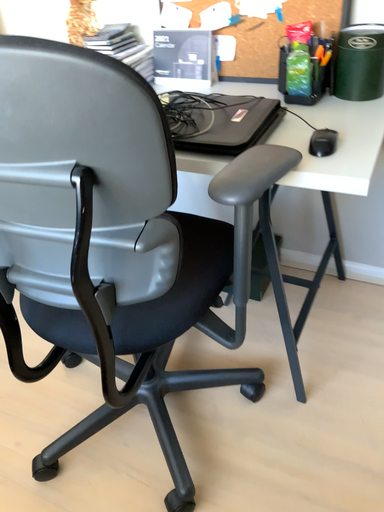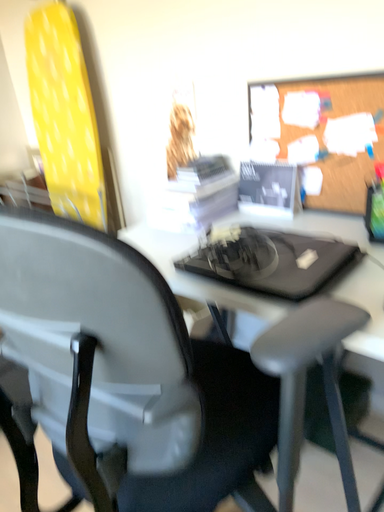
Question: Which way did the camera rotate in the video?

Choices:
 (A) rotated left
 (B) rotated right

Answer: (A)